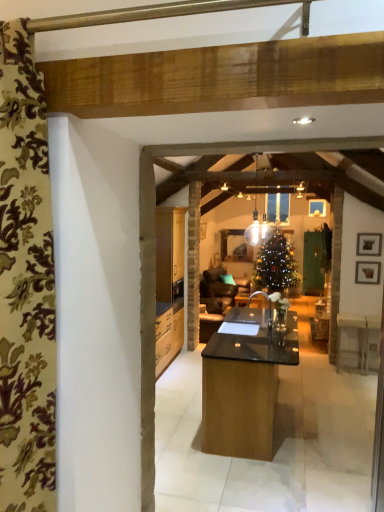
Question: From a real-world perspective, is translucent glass pendant light at center beneath floral fabric curtain at left?

Choices:
 (A) yes
 (B) no

Answer: (B)

Question: Is translucent glass pendant light at center at the left side of floral fabric curtain at left?

Choices:
 (A) no
 (B) yes

Answer: (A)

Question: Are translucent glass pendant light at center and floral fabric curtain at left beside each other?

Choices:
 (A) yes
 (B) no

Answer: (B)

Question: Is translucent glass pendant light at center positioned far away from floral fabric curtain at left?

Choices:
 (A) no
 (B) yes

Answer: (B)

Question: Can you confirm if translucent glass pendant light at center is taller than floral fabric curtain at left?

Choices:
 (A) no
 (B) yes

Answer: (A)

Question: From the image's perspective, is wooden picture frame at right, the first picture frame in the bottom-to-top sequence, above or below black matte picture frame at upper right, the 2th picture frame positioned from the bottom?

Choices:
 (A) above
 (B) below

Answer: (B)

Question: Is wooden picture frame at right, which is the 2th picture frame from top to bottom, taller or shorter than black matte picture frame at upper right, which is the first picture frame from top to bottom?

Choices:
 (A) short
 (B) tall

Answer: (A)

Question: Considering the positions of wooden picture frame at right, which is the 2th picture frame from top to bottom, and black matte picture frame at upper right, which is the first picture frame from top to bottom, in the image, is wooden picture frame at right, which is the 2th picture frame from top to bottom, wider or thinner than black matte picture frame at upper right, which is the first picture frame from top to bottom,?

Choices:
 (A) thin
 (B) wide

Answer: (A)

Question: Is wooden picture frame at right, which is the 2th picture frame from top to bottom, to the left or to the right of black matte picture frame at upper right, which is the first picture frame from top to bottom, in the image?

Choices:
 (A) right
 (B) left

Answer: (B)

Question: Considering the positions of translucent glass pendant light at center and wooden picture frame at right, the first picture frame in the bottom-to-top sequence, in the image, is translucent glass pendant light at center bigger or smaller than wooden picture frame at right, the first picture frame in the bottom-to-top sequence,?

Choices:
 (A) big
 (B) small

Answer: (A)

Question: Would you say translucent glass pendant light at center is to the left or to the right of wooden picture frame at right, which is the 2th picture frame from top to bottom, in the picture?

Choices:
 (A) right
 (B) left

Answer: (B)

Question: Is translucent glass pendant light at center wider or thinner than wooden picture frame at right, the first picture frame in the bottom-to-top sequence?

Choices:
 (A) wide
 (B) thin

Answer: (A)

Question: Considering their positions, is translucent glass pendant light at center located in front of or behind wooden picture frame at right, which is the 2th picture frame from top to bottom?

Choices:
 (A) front
 (B) behind

Answer: (A)

Question: Considering the positions of point (362, 234) and point (264, 238), is point (362, 234) closer or farther from the camera than point (264, 238)?

Choices:
 (A) farther
 (B) closer

Answer: (B)

Question: From the image's perspective, is black matte picture frame at upper right, the 2th picture frame positioned from the bottom, located above or below translucent glass pendant light at center?

Choices:
 (A) below
 (B) above

Answer: (A)